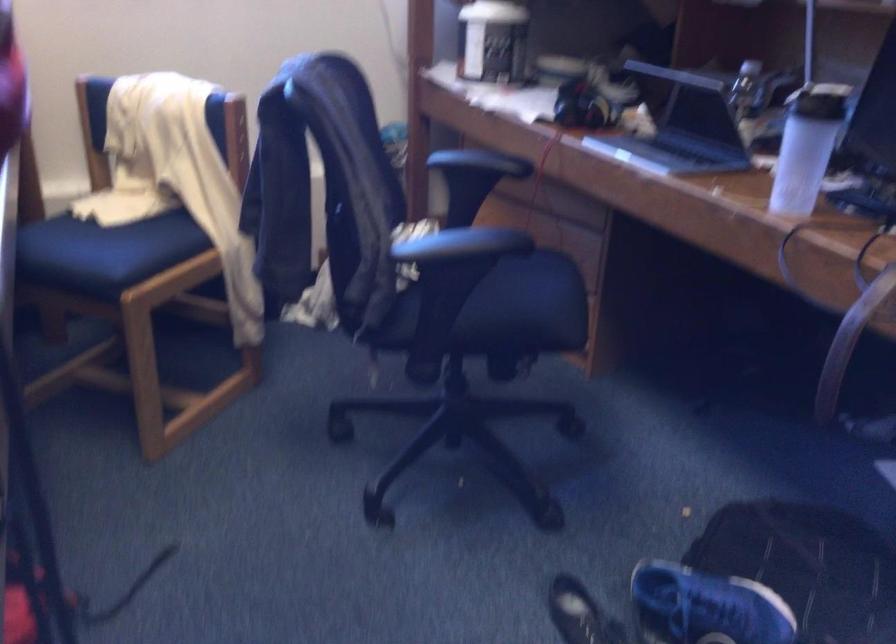
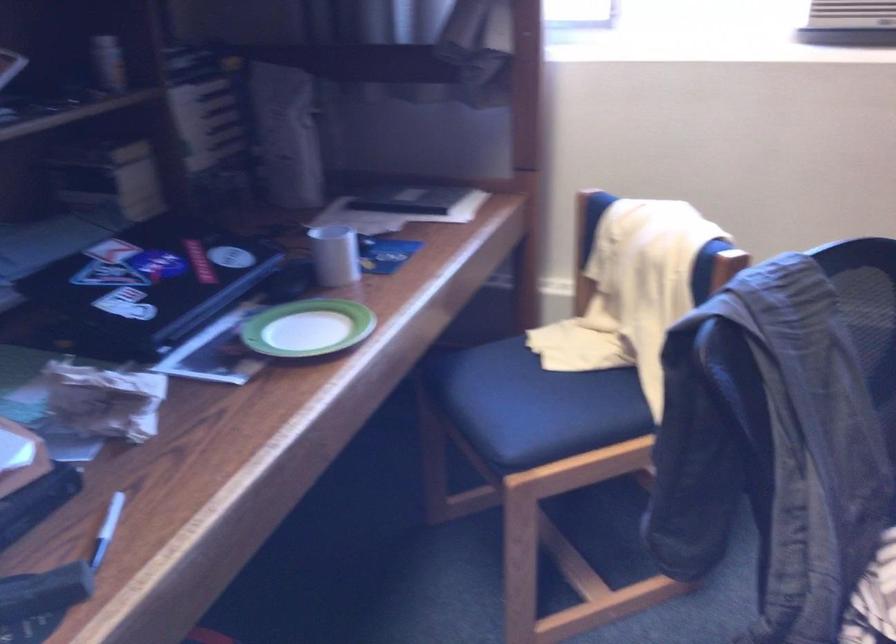
Question: How did the camera likely rotate?

Choices:
 (A) Left
 (B) Right
 (C) Up
 (D) Down

Answer: (A)